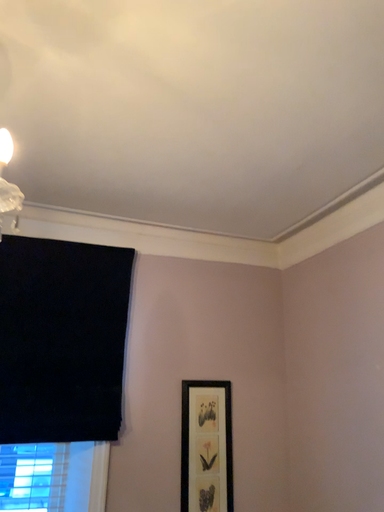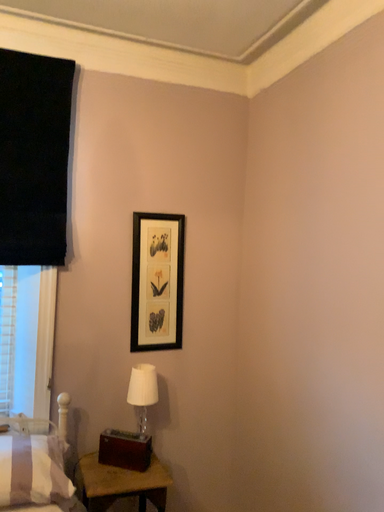
Question: How did the camera likely rotate when shooting the video?

Choices:
 (A) rotated upward
 (B) rotated downward

Answer: (B)